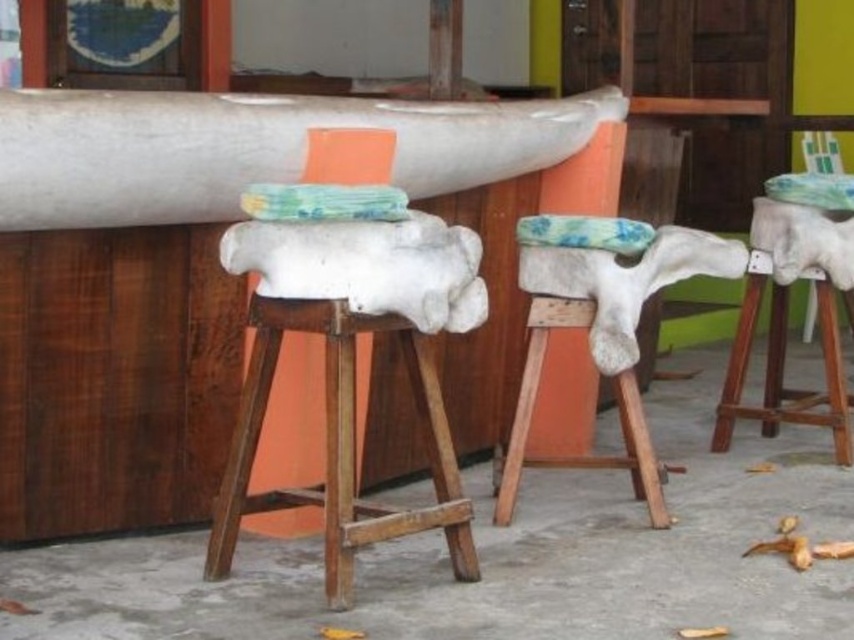
Question: Which point is farther to the camera?

Choices:
 (A) (127, 218)
 (B) (778, 280)
 (C) (603, 257)

Answer: (B)

Question: Which point appears farthest from the camera in this image?

Choices:
 (A) (733, 374)
 (B) (145, 131)
 (C) (461, 516)
 (D) (524, 390)

Answer: (A)

Question: Can you confirm if white stone stool at center is positioned to the left of white fur-covered stool at center?

Choices:
 (A) no
 (B) yes

Answer: (B)

Question: Which object is farther from the camera taking this photo?

Choices:
 (A) white leather stool at center
 (B) white fur-covered stool at center
 (C) white stone stool at center

Answer: (A)

Question: From the image, what is the correct spatial relationship of white fur-covered stool at center in relation to white leather stool at center?

Choices:
 (A) right
 (B) left

Answer: (B)

Question: Can you confirm if white stone stool at center is positioned below white fur-covered stool at center?

Choices:
 (A) yes
 (B) no

Answer: (A)